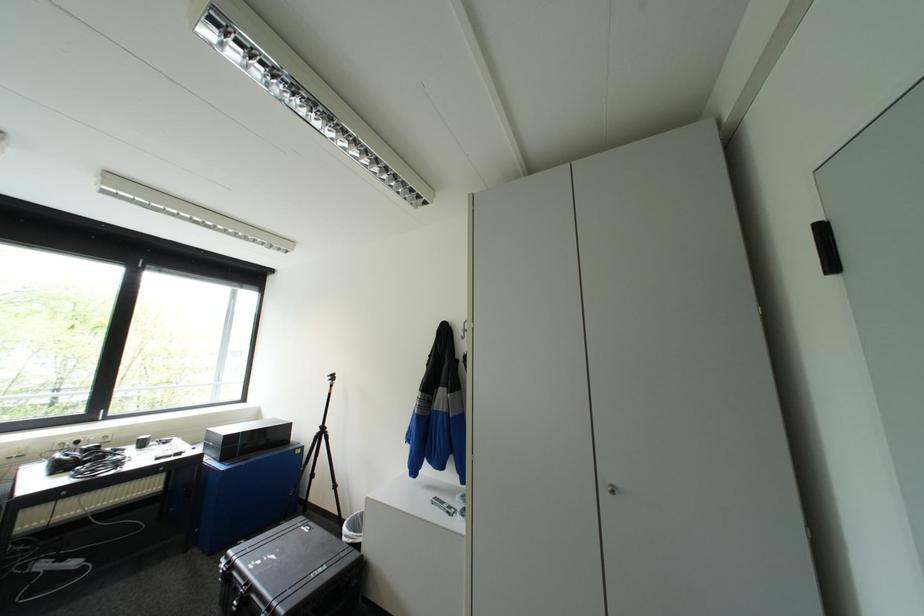
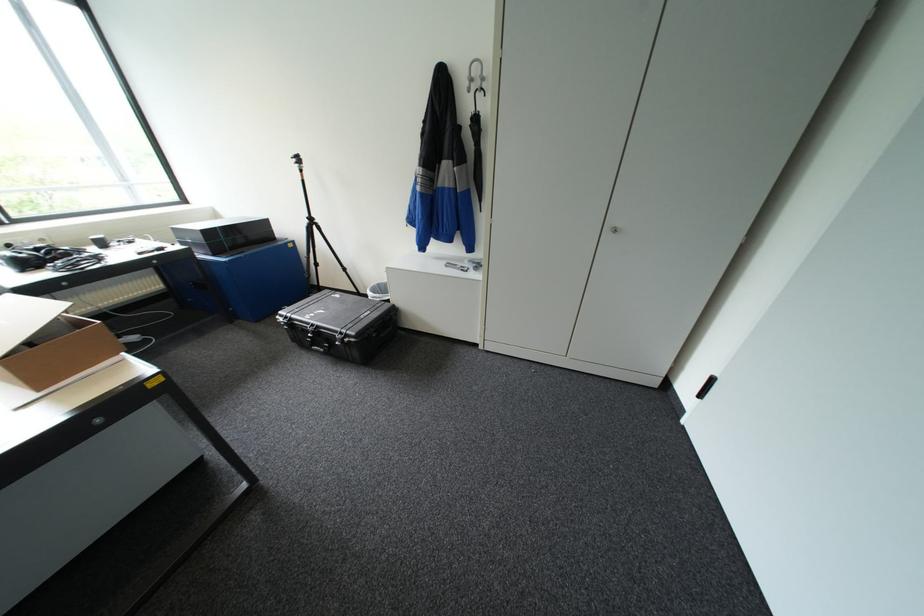
Question: How did the camera likely rotate?

Choices:
 (A) Left
 (B) Right
 (C) Up
 (D) Down

Answer: (D)